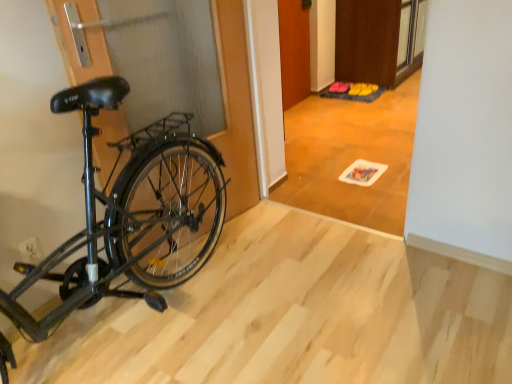
This screenshot has height=384, width=512. What do you see at coordinates (30, 251) in the screenshot?
I see `white plastic power plug at lower left` at bounding box center [30, 251].

What do you see at coordinates (127, 214) in the screenshot?
I see `black matte bicycle at left` at bounding box center [127, 214].

In order to click on brown matte door at upper center, which is the 1th door from right to left in this screenshot , I will do `click(367, 41)`.

Where is `yellow fabric walking shoe at center, the first walking shoe in the right-to-left sequence`? yellow fabric walking shoe at center, the first walking shoe in the right-to-left sequence is located at coordinates (362, 89).

Locate an element on the screen. The height and width of the screenshot is (384, 512). white plastic power plug at lower left is located at coordinates (30, 251).

Considering the sizes of objects yellow fabric shoe at center, placed as the first walking shoe when sorted from left to right, and black matte bicycle at left in the image provided, who is taller, yellow fabric shoe at center, placed as the first walking shoe when sorted from left to right, or black matte bicycle at left?

Standing taller between the two is black matte bicycle at left.

From the image's perspective, is yellow fabric shoe at center, arranged as the second walking shoe when viewed from the right, on top of black matte bicycle at left?

Yes.

From a real-world perspective, is yellow fabric shoe at center, arranged as the second walking shoe when viewed from the right, below black matte bicycle at left?

Indeed, from a real-world perspective, yellow fabric shoe at center, arranged as the second walking shoe when viewed from the right, is positioned beneath black matte bicycle at left.

Does yellow fabric shoe at center, arranged as the second walking shoe when viewed from the right, have a larger size compared to black matte bicycle at left?

No, yellow fabric shoe at center, arranged as the second walking shoe when viewed from the right, is not bigger than black matte bicycle at left.

Who is shorter, black matte bicycle at left or wooden door at center, which is the first door in left-to-right order?

With less height is wooden door at center, which is the first door in left-to-right order.

Is black matte bicycle at left bigger than wooden door at center, which is the first door in left-to-right order?

Yes.

Based on the photo, from the image's perspective, which one is positioned lower, black matte bicycle at left or wooden door at center, the second door when ordered from right to left?

From the image's view, black matte bicycle at left is below.

Is black matte bicycle at left not within wooden door at center, the second door when ordered from right to left?

Yes.

Does white plastic power plug at lower left have a lesser height compared to brown matte door at upper center, which is the 1th door from right to left?

Indeed, white plastic power plug at lower left has a lesser height compared to brown matte door at upper center, which is the 1th door from right to left.

Is white plastic power plug at lower left aimed at brown matte door at upper center, placed as the second door when sorted from left to right?

No.

From the image's perspective, is white plastic power plug at lower left below brown matte door at upper center, placed as the second door when sorted from left to right?

Yes, from the image's perspective, white plastic power plug at lower left is below brown matte door at upper center, placed as the second door when sorted from left to right.

Can you confirm if white plastic power plug at lower left is positioned to the right of brown matte door at upper center, which is the 1th door from right to left?

Incorrect, white plastic power plug at lower left is not on the right side of brown matte door at upper center, which is the 1th door from right to left.

Does wooden door at center, which is the first door in left-to-right order, have a lesser height compared to yellow fabric walking shoe at center, the 2th walking shoe viewed from the left?

In fact, wooden door at center, which is the first door in left-to-right order, may be taller than yellow fabric walking shoe at center, the 2th walking shoe viewed from the left.

Does wooden door at center, the second door when ordered from right to left, have a greater width compared to yellow fabric walking shoe at center, the first walking shoe in the right-to-left sequence?

In fact, wooden door at center, the second door when ordered from right to left, might be narrower than yellow fabric walking shoe at center, the first walking shoe in the right-to-left sequence.

Is wooden door at center, which is the first door in left-to-right order, smaller than yellow fabric walking shoe at center, the 2th walking shoe viewed from the left?

No, wooden door at center, which is the first door in left-to-right order, is not smaller than yellow fabric walking shoe at center, the 2th walking shoe viewed from the left.

From a real-world perspective, which object rests below the other?

From a 3D spatial view, yellow fabric walking shoe at center, the first walking shoe in the right-to-left sequence, is below.

Considering the sizes of objects yellow fabric walking shoe at center, the 2th walking shoe viewed from the left, and wooden tile floor at center in the image provided, who is wider, yellow fabric walking shoe at center, the 2th walking shoe viewed from the left, or wooden tile floor at center?

Wider between the two is wooden tile floor at center.

Considering the positions of points (376, 85) and (334, 217), is point (376, 85) farther from camera compared to point (334, 217)?

Yes, point (376, 85) is farther from viewer.

Could wooden tile floor at center be considered to be inside yellow fabric walking shoe at center, the first walking shoe in the right-to-left sequence?

No, wooden tile floor at center is not inside yellow fabric walking shoe at center, the first walking shoe in the right-to-left sequence.

From a real-world perspective, between yellow fabric walking shoe at center, the first walking shoe in the right-to-left sequence, and wooden tile floor at center, who is vertically higher?

wooden tile floor at center.

Is yellow fabric walking shoe at center, the 2th walking shoe viewed from the left, spatially inside black matte bicycle at left, or outside of it?

The correct answer is: outside.

From the image's perspective, between yellow fabric walking shoe at center, the first walking shoe in the right-to-left sequence, and black matte bicycle at left, which one is located above?

From the image's view, yellow fabric walking shoe at center, the first walking shoe in the right-to-left sequence, is above.

Locate an element on the screen. bicycle that appears in front of the yellow fabric walking shoe at center, the 2th walking shoe viewed from the left is located at coordinates (127, 214).

Is point (350, 88) closer to camera compared to point (13, 310)?

No.

Considering the points (113, 146) and (379, 132), which point is behind, point (113, 146) or point (379, 132)?

Point (379, 132)

Considering the relative positions of black matte bicycle at left and wooden tile floor at center in the image provided, is black matte bicycle at left to the right of wooden tile floor at center from the viewer's perspective?

In fact, black matte bicycle at left is to the left of wooden tile floor at center.

Find the location of `bicycle below the wooden tile floor at center (from the image's perspective)`. bicycle below the wooden tile floor at center (from the image's perspective) is located at coordinates (127, 214).

Consider the image. From a real-world perspective, between black matte bicycle at left and wooden tile floor at center, who is vertically higher?

In real-world perspective, black matte bicycle at left is above.

In the image, there is a yellow fabric shoe at center, placed as the first walking shoe when sorted from left to right. Where is `bicycle below it (from the image's perspective)`? bicycle below it (from the image's perspective) is located at coordinates (127, 214).

The image size is (512, 384). I want to click on bicycle located in front of the wooden door at center, which is the first door in left-to-right order, so (127, 214).

Estimate the real-world distances between objects in this image. Which object is further from wooden tile floor at center, wooden door at center, which is the first door in left-to-right order, or black matte bicycle at left?

black matte bicycle at left is further to wooden tile floor at center.

Estimate the real-world distances between objects in this image. Which object is further from yellow fabric walking shoe at center, the 2th walking shoe viewed from the left, brown matte door at upper center, placed as the second door when sorted from left to right, or black matte bicycle at left?

black matte bicycle at left lies further to yellow fabric walking shoe at center, the 2th walking shoe viewed from the left, than the other object.

From the image, which object appears to be nearer to brown matte door at upper center, which is the 1th door from right to left, white plastic power plug at lower left or black matte bicycle at left?

black matte bicycle at left is closer to brown matte door at upper center, which is the 1th door from right to left.

From the image, which object appears to be farther from yellow fabric walking shoe at center, the 2th walking shoe viewed from the left, white plastic power plug at lower left or black matte bicycle at left?

Based on the image, white plastic power plug at lower left appears to be further to yellow fabric walking shoe at center, the 2th walking shoe viewed from the left.

Consider the image. Estimate the real-world distances between objects in this image. Which object is further from white plastic power plug at lower left, yellow fabric walking shoe at center, the 2th walking shoe viewed from the left, or brown matte door at upper center, placed as the second door when sorted from left to right?

brown matte door at upper center, placed as the second door when sorted from left to right.

Estimate the real-world distances between objects in this image. Which object is further from yellow fabric shoe at center, arranged as the second walking shoe when viewed from the right, white plastic power plug at lower left or black matte bicycle at left?

Among the two, white plastic power plug at lower left is located further to yellow fabric shoe at center, arranged as the second walking shoe when viewed from the right.

Looking at the image, which one is located further to black matte bicycle at left, wooden door at center, the second door when ordered from right to left, or wooden tile floor at center?

wooden door at center, the second door when ordered from right to left, is positioned further to the anchor black matte bicycle at left.

Based on their spatial positions, is wooden tile floor at center or white plastic power plug at lower left further from yellow fabric walking shoe at center, the 2th walking shoe viewed from the left?

Among the two, white plastic power plug at lower left is located further to yellow fabric walking shoe at center, the 2th walking shoe viewed from the left.

Identify the location of corridor positioned between black matte bicycle at left and yellow fabric walking shoe at center, the first walking shoe in the right-to-left sequence, from near to far. (351, 156).

Find the location of `power plugs and sockets between wooden tile floor at center and wooden door at center, which is the first door in left-to-right order, in the front-back direction`. power plugs and sockets between wooden tile floor at center and wooden door at center, which is the first door in left-to-right order, in the front-back direction is located at coordinates (30, 251).

I want to click on walking shoe between brown matte door at upper center, placed as the second door when sorted from left to right, and yellow fabric walking shoe at center, the 2th walking shoe viewed from the left, in the vertical direction, so click(x=340, y=87).

This screenshot has width=512, height=384. Identify the location of power plugs and sockets positioned between wooden tile floor at center and brown matte door at upper center, which is the 1th door from right to left, from near to far. (30, 251).